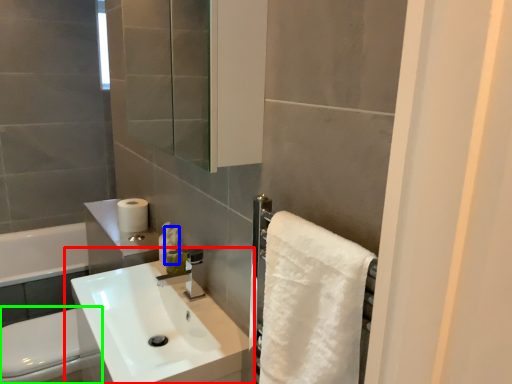
Question: Which object is positioned farthest from sink (highlighted by a red box)? Select from soap dispenser (highlighted by a blue box) and toilet bowl (highlighted by a green box).

Choices:
 (A) soap dispenser
 (B) toilet bowl

Answer: (A)